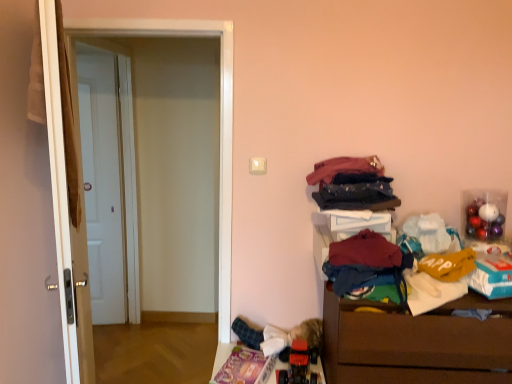
Locate an element on the screen. Image resolution: width=512 pixels, height=384 pixels. free point above dark blue fabric at upper right, positioned as the 2th clothing in top-to-bottom order (from a real-world perspective) is located at coordinates (357, 182).